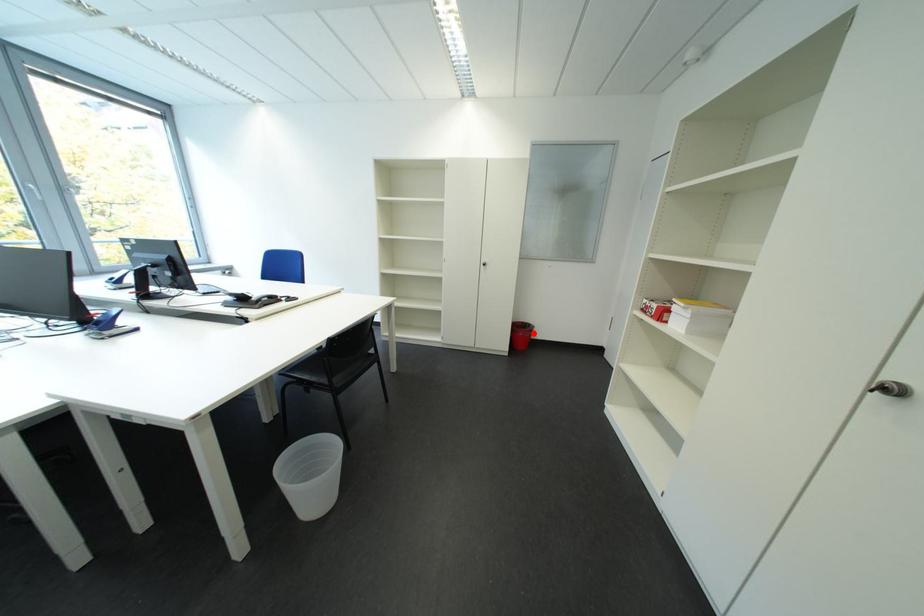
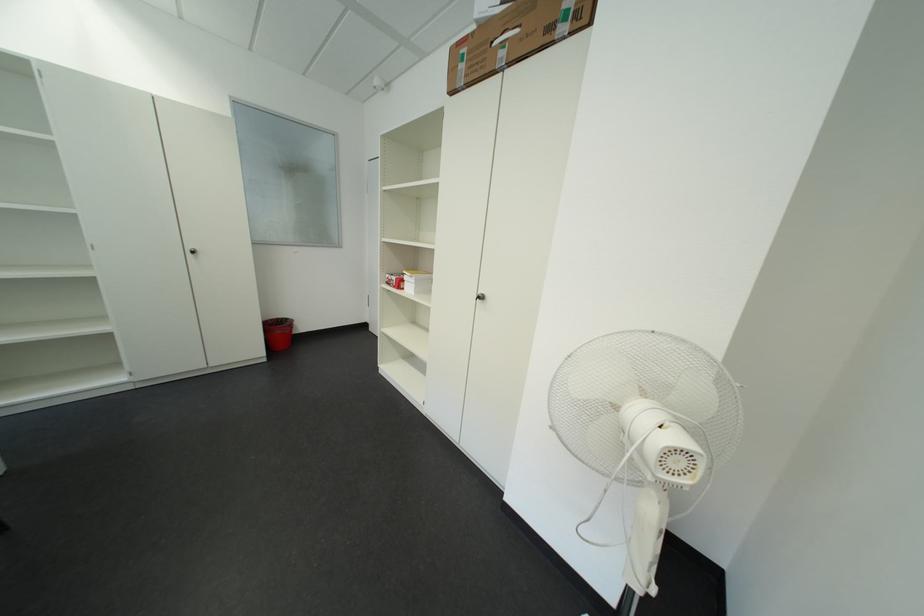
In the second image, find the point that corresponds to the highlighted location in the first image.

(289, 331)